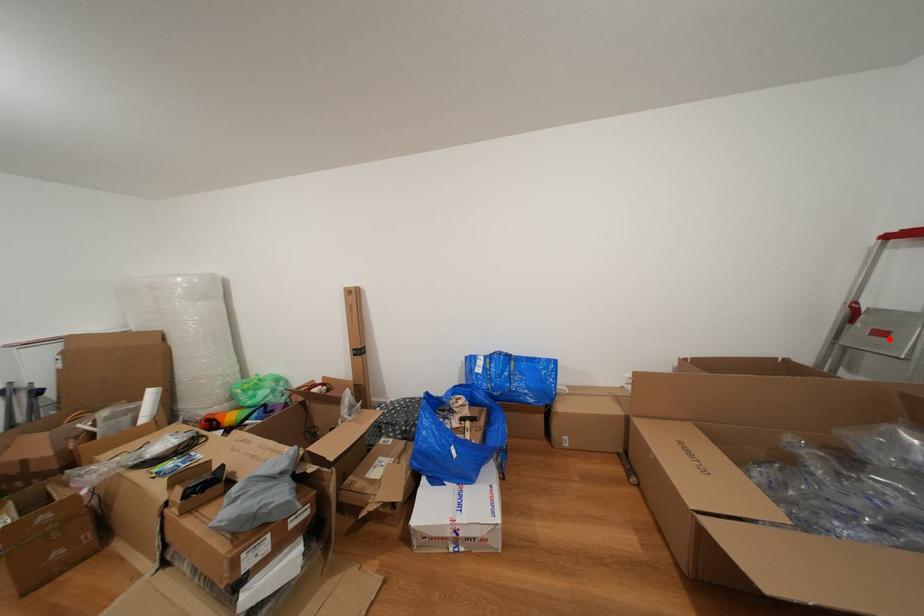
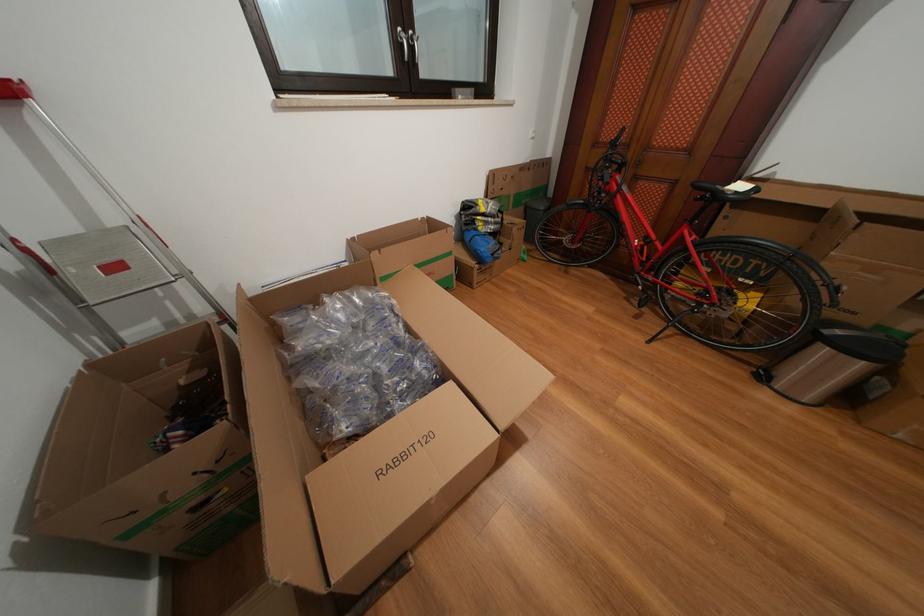
Question: I am providing you with two images of the same scene from different viewpoints. Image1 has a red point marked. In image2, the corresponding 3D location appears at what relative position? Reply with the corresponding letter.

Choices:
 (A) Closer
 (B) Farther

Answer: (B)